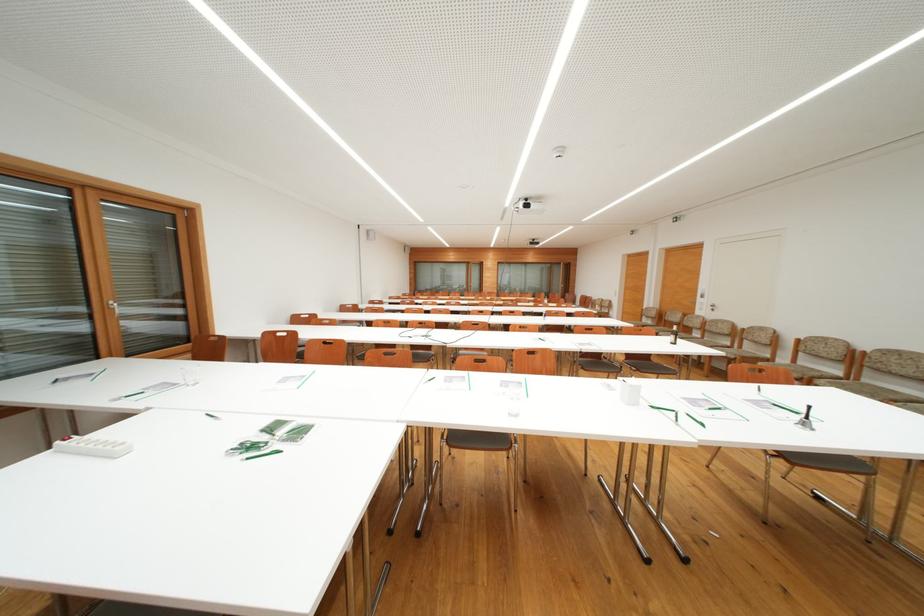
The width and height of the screenshot is (924, 616). What do you see at coordinates (480, 428) in the screenshot?
I see `the upholstered chair sitting surface` at bounding box center [480, 428].